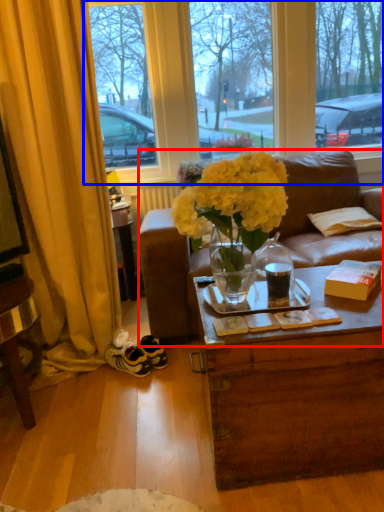
Question: Among these objects, which one is nearest to the camera, studio couch (highlighted by a red box) or window (highlighted by a blue box)?

Choices:
 (A) studio couch
 (B) window

Answer: (A)